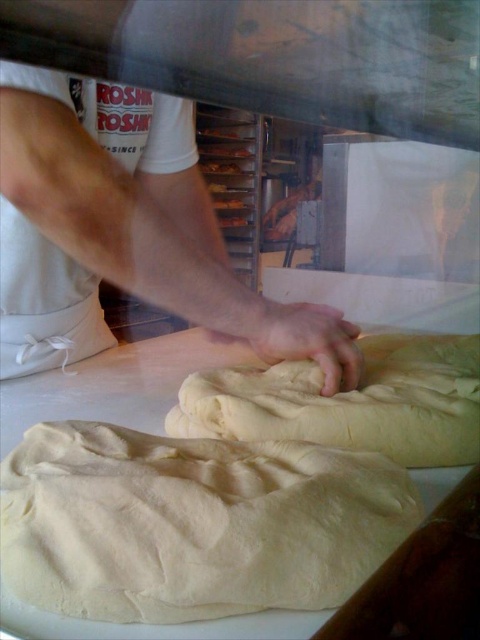
Question: Is white fluffy dough at center below white soft dough at center?

Choices:
 (A) yes
 (B) no

Answer: (A)

Question: From the image, what is the correct spatial relationship of white fluffy dough at center in relation to white fabric arm at upper left?

Choices:
 (A) below
 (B) above

Answer: (A)

Question: Which object is closer to the camera taking this photo?

Choices:
 (A) white soft dough at center
 (B) smooth white hand at center
 (C) white fluffy dough at center
 (D) white fabric arm at upper left

Answer: (D)

Question: Among these points, which one is nearest to the camera?

Choices:
 (A) (276, 378)
 (B) (267, 348)

Answer: (B)

Question: Considering the real-world distances, which object is farthest from the white soft dough at center?

Choices:
 (A) smooth white hand at center
 (B) white fluffy dough at center

Answer: (B)

Question: Does white fluffy dough at center have a lesser width compared to white soft dough at center?

Choices:
 (A) yes
 (B) no

Answer: (A)